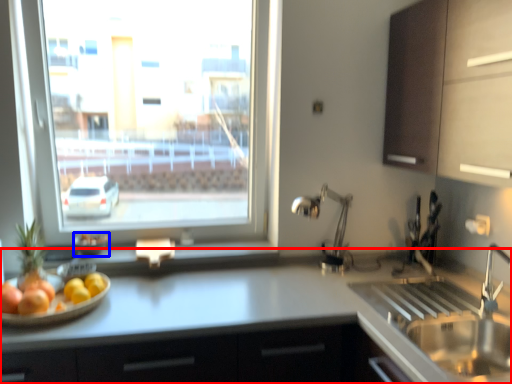
Question: Among these objects, which one is nearest to the camera, countertop (highlighted by a red box) or glass bowl (highlighted by a blue box)?

Choices:
 (A) countertop
 (B) glass bowl

Answer: (A)